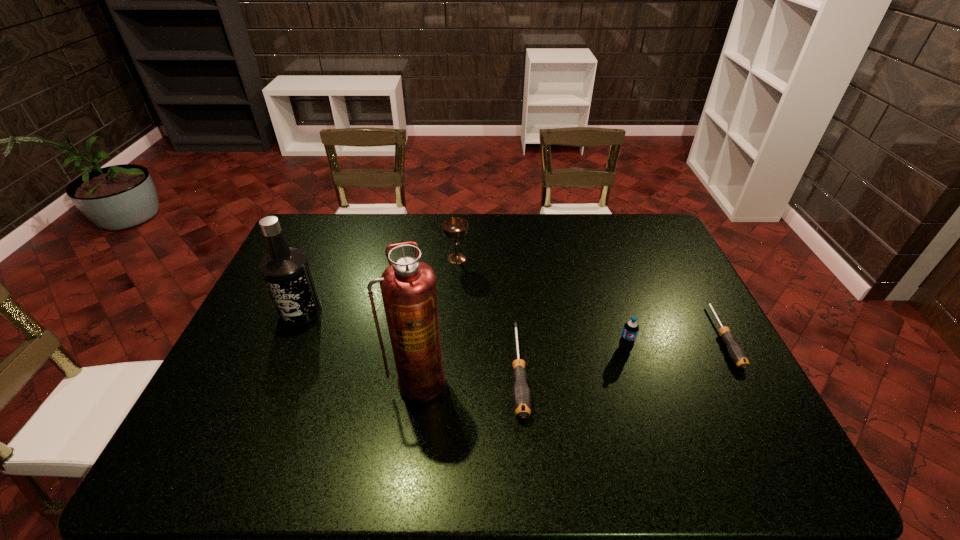
At what (x,y) coordinates should I click in order to perform the action: click on free region located on the left of the taller screwdriver. Please return your answer as a coordinate pair (x, y). This screenshot has width=960, height=540. Looking at the image, I should click on (417, 371).

Where is `free space located on the back of the right screwdriver`? free space located on the back of the right screwdriver is located at coordinates (681, 259).

Where is `vacant area situated on the left of the farthest object`? Image resolution: width=960 pixels, height=540 pixels. vacant area situated on the left of the farthest object is located at coordinates (368, 259).

Find the location of a particular element. The image size is (960, 540). free space located on the front label of the leftmost object is located at coordinates (278, 363).

You are a GUI agent. You are given a task and a screenshot of the screen. Output one action in this format:
    pyautogui.click(x=<x>, y=<y>)
    Task: Click on the vacant space situated 0.090m on the right of the soda bottle
    The width and height of the screenshot is (960, 540).
    Given the screenshot: What is the action you would take?
    pyautogui.click(x=665, y=349)

At what (x,y) coordinates should I click in order to perform the action: click on object at the far edge. Please return your answer as a coordinate pair (x, y). This screenshot has height=540, width=960. Looking at the image, I should click on (455, 228).

Find the location of a particular element. screwdriver that is at the near edge is located at coordinates (521, 396).

This screenshot has height=540, width=960. What are the coordinates of `fire extinguisher that is at the near edge` in the screenshot? It's located at (408, 286).

At what (x,y) coordinates should I click in order to perform the action: click on object present at the left edge. Please return your answer as a coordinate pair (x, y). Looking at the image, I should click on (286, 271).

Locate an element on the screen. This screenshot has height=540, width=960. object located in the right edge section of the desktop is located at coordinates (737, 354).